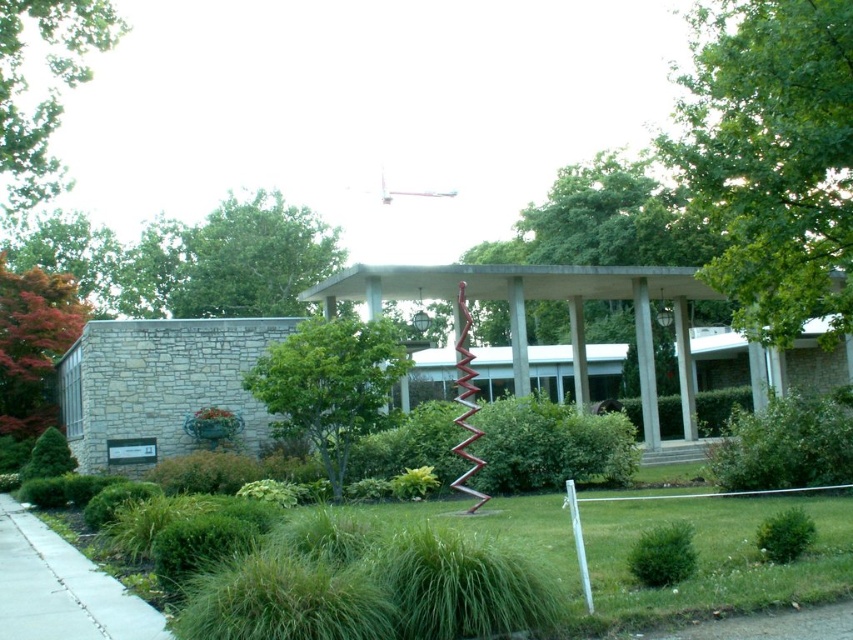
You are a landscape architect planning to install a new bench in this outdoor area. The bench requires a space that is at least as wide as the gray concrete sidewalk at lower left. Based on the scene, is there a suitable location near the green leafy tree at upper center for placing the bench?

The green leafy tree at upper center might be wider than the gray concrete sidewalk at lower left, so the area near the tree may not provide enough space for the bench if the tree itself occupies more width than the required minimum. It would be safer to choose another location with more guaranteed space.

You are a landscape architect designing a new garden path. You need to decide whether the green leafy tree at upper center can be safely planted near the gray concrete sidewalk at lower left. Based on their sizes, is there enough space between them for both to thrive?

The green leafy tree at upper center has a larger size compared to the gray concrete sidewalk at lower left. Therefore, there should be sufficient space between them for both to thrive as long as proper spacing is maintained during planting.